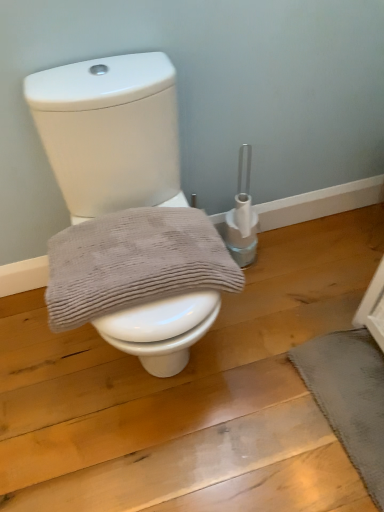
Question: Does dark gray textured bath mat at lower right appear on the right side of gray textured towel at center?

Choices:
 (A) yes
 (B) no

Answer: (A)

Question: Is dark gray textured bath mat at lower right closer to camera compared to gray textured towel at center?

Choices:
 (A) no
 (B) yes

Answer: (A)

Question: Considering the relative sizes of dark gray textured bath mat at lower right and gray textured towel at center in the image provided, is dark gray textured bath mat at lower right shorter than gray textured towel at center?

Choices:
 (A) yes
 (B) no

Answer: (A)

Question: Can you confirm if dark gray textured bath mat at lower right is positioned to the left of gray textured towel at center?

Choices:
 (A) yes
 (B) no

Answer: (B)

Question: From the image's perspective, does dark gray textured bath mat at lower right appear higher than gray textured towel at center?

Choices:
 (A) no
 (B) yes

Answer: (A)

Question: Is white glossy toilet at center situated inside gray textured towel at center or outside?

Choices:
 (A) outside
 (B) inside

Answer: (A)

Question: Considering the relative positions of white glossy toilet at center and gray textured towel at center in the image provided, is white glossy toilet at center to the left or to the right of gray textured towel at center?

Choices:
 (A) right
 (B) left

Answer: (A)

Question: Relative to gray textured towel at center, is white glossy toilet at center in front or behind?

Choices:
 (A) front
 (B) behind

Answer: (A)

Question: From a real-world perspective, is white glossy toilet at center positioned above or below gray textured towel at center?

Choices:
 (A) below
 (B) above

Answer: (A)

Question: Considering the relative positions of dark gray textured bath mat at lower right and gray textured towel at center in the image provided, is dark gray textured bath mat at lower right to the left or to the right of gray textured towel at center?

Choices:
 (A) right
 (B) left

Answer: (A)

Question: Is dark gray textured bath mat at lower right bigger or smaller than gray textured towel at center?

Choices:
 (A) small
 (B) big

Answer: (A)

Question: Relative to gray textured towel at center, is dark gray textured bath mat at lower right in front or behind?

Choices:
 (A) front
 (B) behind

Answer: (B)

Question: Would you say dark gray textured bath mat at lower right is inside or outside gray textured towel at center?

Choices:
 (A) outside
 (B) inside

Answer: (A)

Question: From a real-world perspective, is dark gray textured bath mat at lower right above or below white glossy toilet at center?

Choices:
 (A) above
 (B) below

Answer: (B)

Question: Based on their positions, is dark gray textured bath mat at lower right located to the left or right of white glossy toilet at center?

Choices:
 (A) right
 (B) left

Answer: (A)